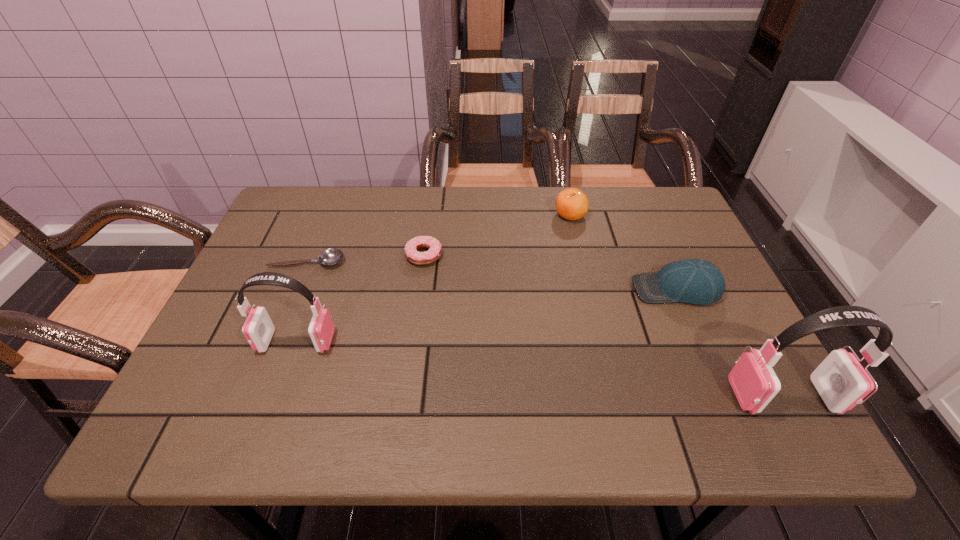
Identify the location of vacant position for inserting another earphone evenly. This screenshot has height=540, width=960. (528, 367).